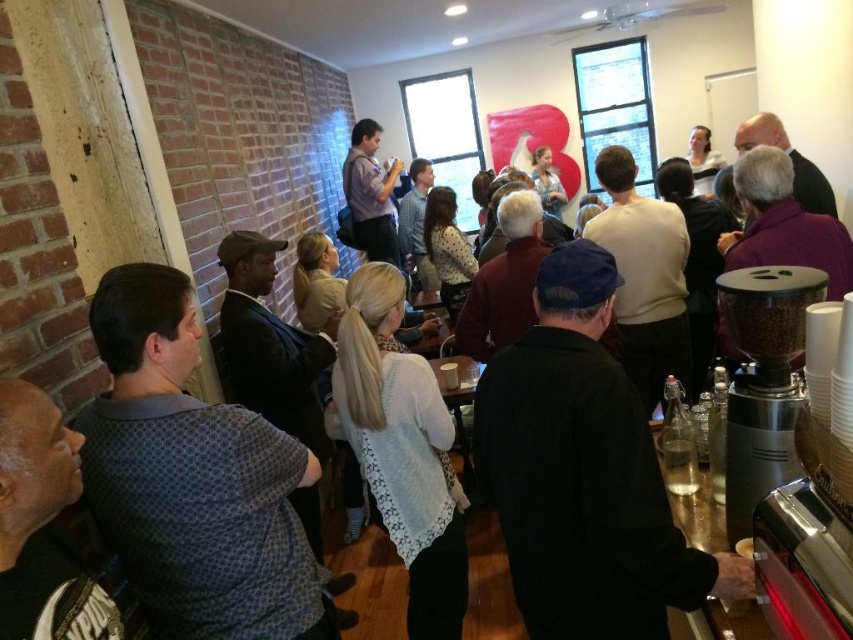
Question: Is metallic gray coffee grinder at right further to the viewer compared to smooth white cup at lower right?

Choices:
 (A) yes
 (B) no

Answer: (B)

Question: Is metallic gray coffee grinder at right further to camera compared to smooth white cup at lower right?

Choices:
 (A) no
 (B) yes

Answer: (A)

Question: Which point is farther to the camera?

Choices:
 (A) smooth white cup at lower right
 (B) metallic gray coffee grinder at right

Answer: (A)

Question: Does metallic gray coffee grinder at right lie in front of smooth white cup at lower right?

Choices:
 (A) yes
 (B) no

Answer: (A)

Question: Which point is closer to the camera?

Choices:
 (A) smooth white cup at lower right
 (B) metallic gray coffee grinder at right

Answer: (B)